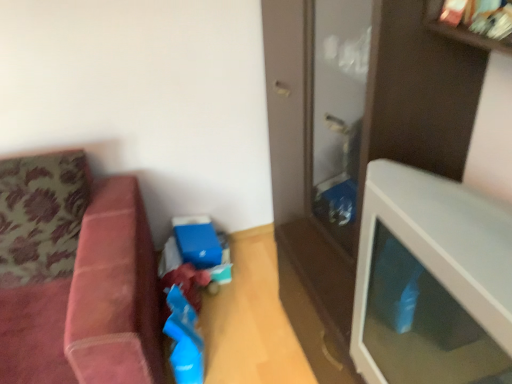
What do you see at coordinates (431, 281) in the screenshot? I see `white glossy table at right` at bounding box center [431, 281].

This screenshot has height=384, width=512. I want to click on white glossy table at right, so click(431, 281).

The width and height of the screenshot is (512, 384). Identify the location of velvet pink couch at left. (75, 276).

The height and width of the screenshot is (384, 512). What do you see at coordinates (75, 276) in the screenshot?
I see `velvet pink couch at left` at bounding box center [75, 276].

The height and width of the screenshot is (384, 512). In order to click on white glossy table at right in this screenshot , I will do `click(431, 281)`.

Based on the photo, is white glossy table at right to the left or to the right of velvet pink couch at left in the image?

Clearly, white glossy table at right is on the right of velvet pink couch at left in the image.

Looking at this image, which object is closer to the camera taking this photo, white glossy table at right or velvet pink couch at left?

white glossy table at right.

Between point (382, 182) and point (36, 192), which one is positioned in front?

The point (382, 182) is more forward.

From the image's perspective, which is above, white glossy table at right or velvet pink couch at left?

white glossy table at right.

From a real-world perspective, relative to velvet pink couch at left, is white glossy table at right vertically above or below?

Clearly, from a real-world perspective, white glossy table at right is above velvet pink couch at left.

Based on the photo, considering the sizes of objects white glossy table at right and velvet pink couch at left in the image provided, who is thinner, white glossy table at right or velvet pink couch at left?

white glossy table at right.

Consider the image. Considering the relative sizes of white glossy table at right and velvet pink couch at left in the image provided, is white glossy table at right shorter than velvet pink couch at left?

Indeed, white glossy table at right has a lesser height compared to velvet pink couch at left.

Is white glossy table at right smaller than velvet pink couch at left?

Indeed, white glossy table at right has a smaller size compared to velvet pink couch at left.

Is velvet pink couch at left inside white glossy table at right?

No, velvet pink couch at left is not a part of white glossy table at right.

Is the surface of white glossy table at right in direct contact with velvet pink couch at left?

No, white glossy table at right is not beside velvet pink couch at left.

Is velvet pink couch at left at the back of white glossy table at right?

No, white glossy table at right is not facing the opposite direction of velvet pink couch at left.

In the scene shown: How many degrees apart are the facing directions of white glossy table at right and velvet pink couch at left?

86.9 degrees.

Measure the distance from white glossy table at right to velvet pink couch at left.

34.92 inches.

I want to click on table above the velvet pink couch at left (from a real-world perspective), so [x=431, y=281].

Is velvet pink couch at left at the right side of white glossy table at right?

No, velvet pink couch at left is not to the right of white glossy table at right.

Is velvet pink couch at left closer to camera compared to white glossy table at right?

No, the depth of velvet pink couch at left is greater than that of white glossy table at right.

Is point (73, 319) closer or farther from the camera than point (484, 323)?

Clearly, point (73, 319) is more distant from the camera than point (484, 323).

From the image's perspective, which is above, velvet pink couch at left or white glossy table at right?

white glossy table at right is shown above in the image.

From a real-world perspective, between velvet pink couch at left and white glossy table at right, who is vertically higher?

From a 3D spatial view, white glossy table at right is above.

Can you confirm if velvet pink couch at left is wider than white glossy table at right?

Indeed, velvet pink couch at left has a greater width compared to white glossy table at right.

From the picture: Does velvet pink couch at left have a lesser height compared to white glossy table at right?

No, velvet pink couch at left is not shorter than white glossy table at right.

Between velvet pink couch at left and white glossy table at right, which one has smaller size?

With smaller size is white glossy table at right.

Do you think velvet pink couch at left is within white glossy table at right, or outside of it?

velvet pink couch at left exists outside the volume of white glossy table at right.

Consider the image. Is velvet pink couch at left far from white glossy table at right?

No, velvet pink couch at left is not far away from white glossy table at right.

Is velvet pink couch at left oriented towards white glossy table at right?

No, velvet pink couch at left does not turn towards white glossy table at right.

Identify the location of studio couch to the left of white glossy table at right. The width and height of the screenshot is (512, 384). (75, 276).

Identify the location of studio couch behind the white glossy table at right. (75, 276).

Locate an element on the screen. The height and width of the screenshot is (384, 512). studio couch that appears on the left of white glossy table at right is located at coordinates (75, 276).